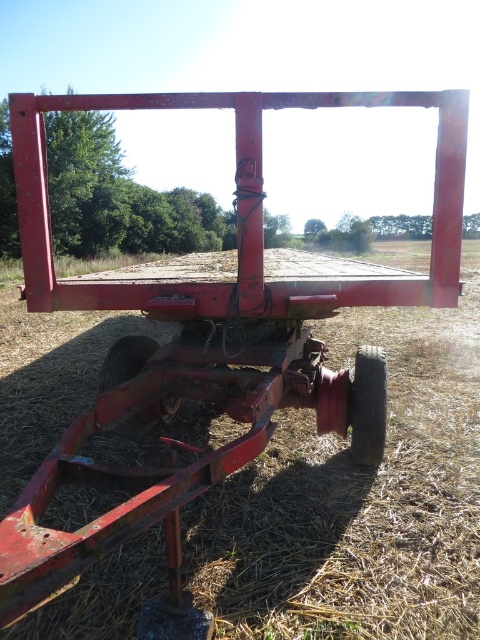
Is rubber/rough wheel at lower right positioned at the back of rubber/rough wheel at lower left?

Yes.

Is point (380, 448) in front of point (126, 422)?

That is True.

I want to click on rubber/rough wheel at lower right, so click(x=369, y=406).